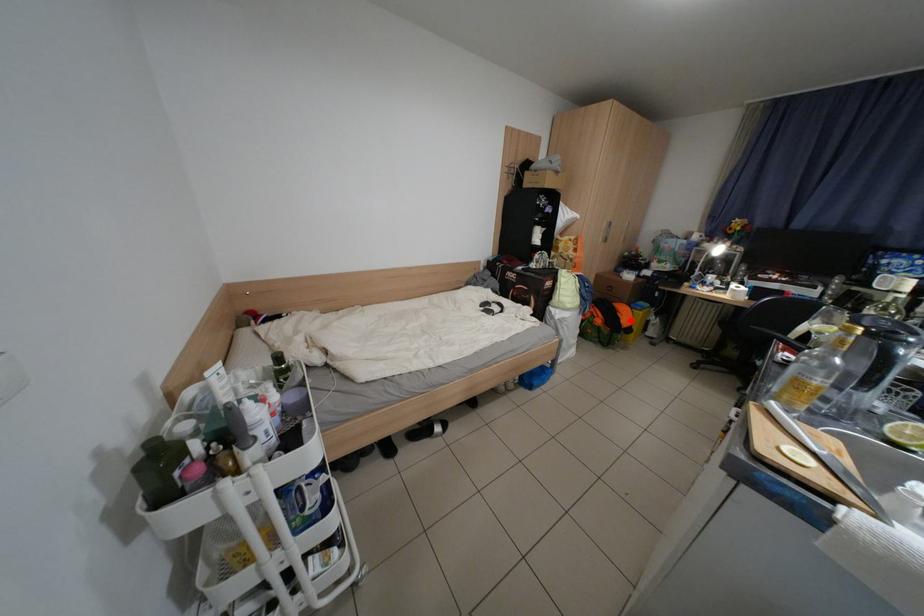
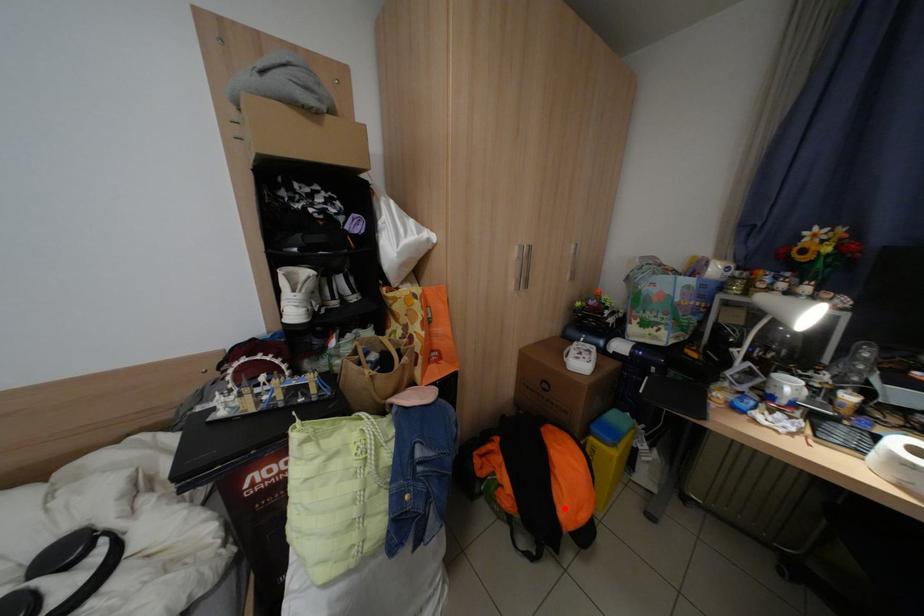
I am providing you with two images of the same scene from different viewpoints. A red point is marked on the first image and another point is marked on the second image. Do the highlighted points in image1 and image2 indicate the same real-world spot?

Yes